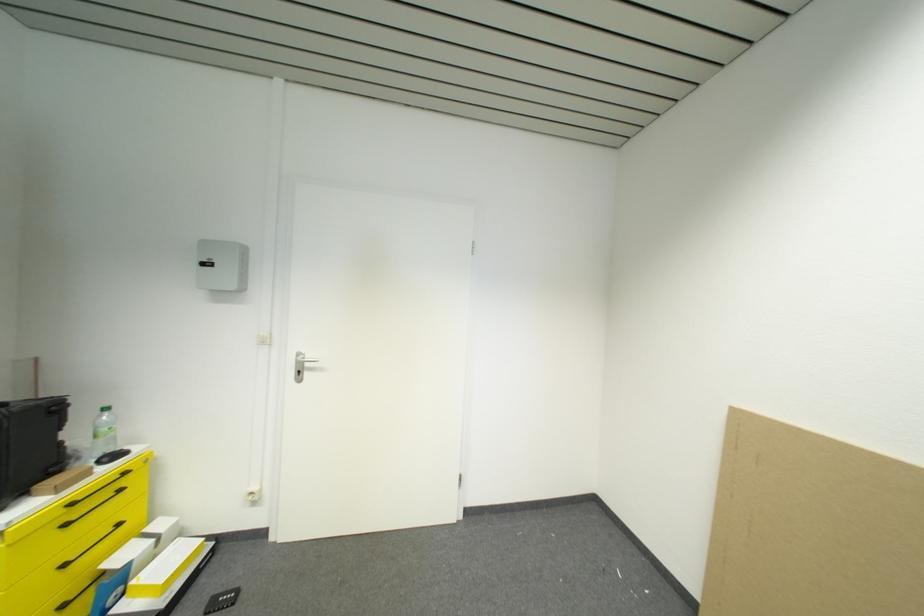
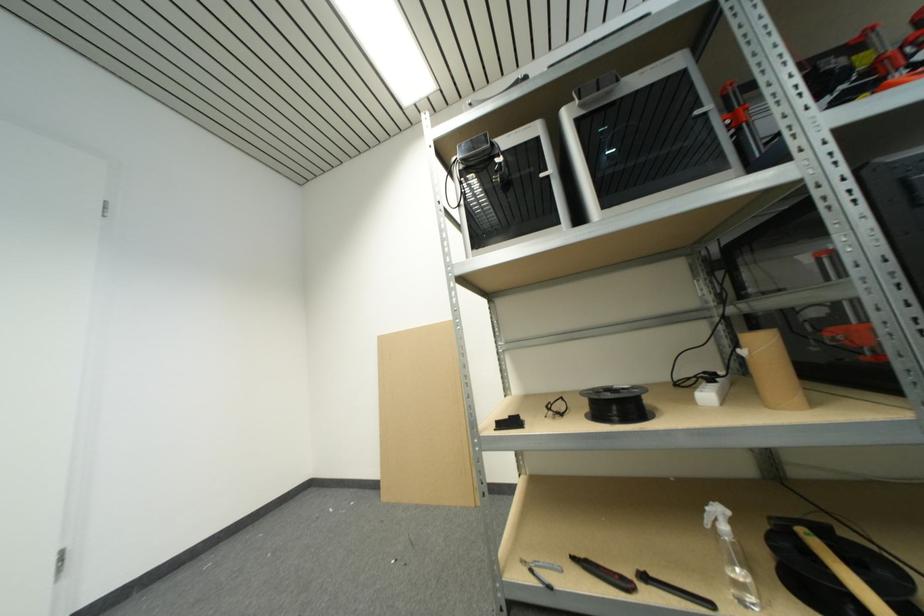
Question: How did the camera likely rotate?

Choices:
 (A) Left
 (B) Right
 (C) Up
 (D) Down

Answer: (B)